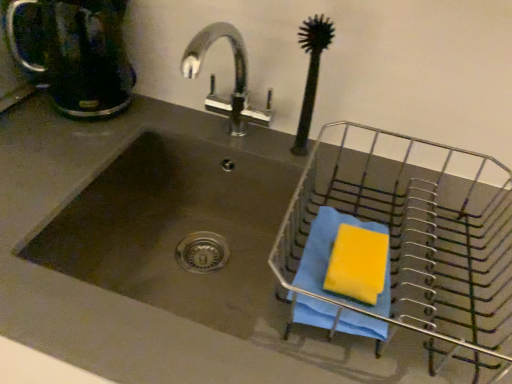
Question: From the image's perspective, is matte black coffeepot at upper left above or below metallic wire basket at right?

Choices:
 (A) below
 (B) above

Answer: (B)

Question: Based on their sizes in the image, would you say matte black coffeepot at upper left is bigger or smaller than metallic wire basket at right?

Choices:
 (A) small
 (B) big

Answer: (A)

Question: Considering the real-world distances, which object is closest to the metallic wire basket at right?

Choices:
 (A) stainless steel sink at center
 (B) black rubber brush at upper right
 (C) yellow sponge at right
 (D) blue cloth at right
 (E) matte black coffeepot at upper left

Answer: (D)

Question: Which object is positioned farthest from the blue cloth at right?

Choices:
 (A) yellow sponge at right
 (B) metallic wire basket at right
 (C) matte black coffeepot at upper left
 (D) black rubber brush at upper right
 (E) stainless steel sink at center

Answer: (C)